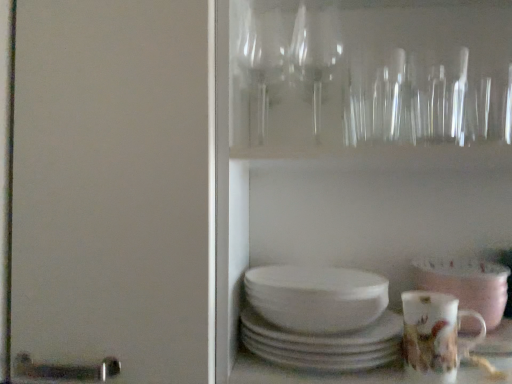
Question: Based on their positions, is porcelain floral mug at lower right located to the left or right of white glossy bowl at lower right?

Choices:
 (A) left
 (B) right

Answer: (A)

Question: Is porcelain floral mug at lower right spatially inside white glossy bowl at lower right, or outside of it?

Choices:
 (A) outside
 (B) inside

Answer: (A)

Question: Which is farther from the porcelain floral mug at lower right?

Choices:
 (A) white glossy plates at center
 (B) white glossy bowl at lower right

Answer: (A)

Question: Based on their relative distances, which object is farther from the porcelain floral mug at lower right?

Choices:
 (A) white glossy bowl at lower right
 (B) white glossy plates at center

Answer: (B)